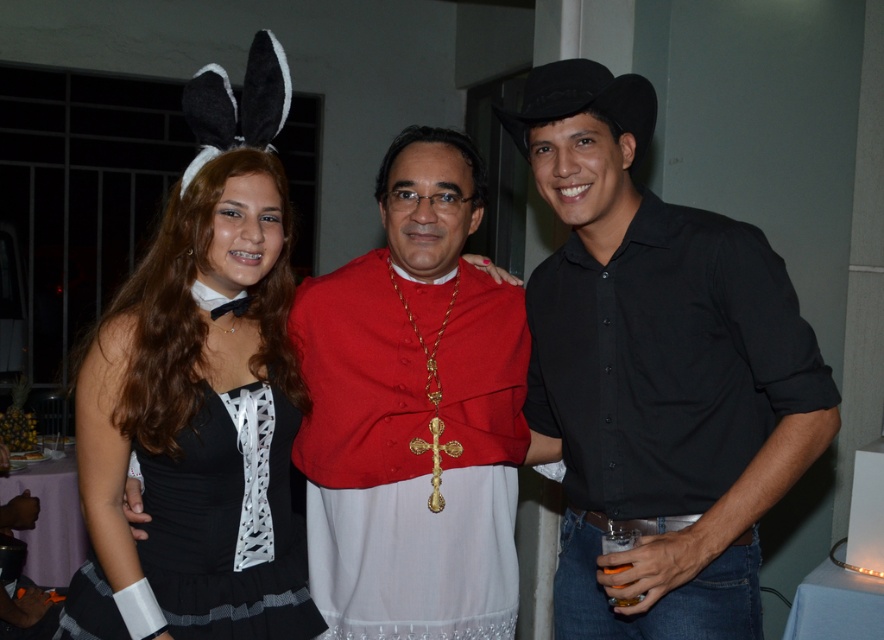
You are planning to wear either the red velvet cape at center or the black satin dress at center to a costume party. Which one would you choose if you want to stand out more due to its size?

The red velvet cape at center is bigger than the black satin dress at center, so choosing the red velvet cape at center would make you stand out more due to its larger size.